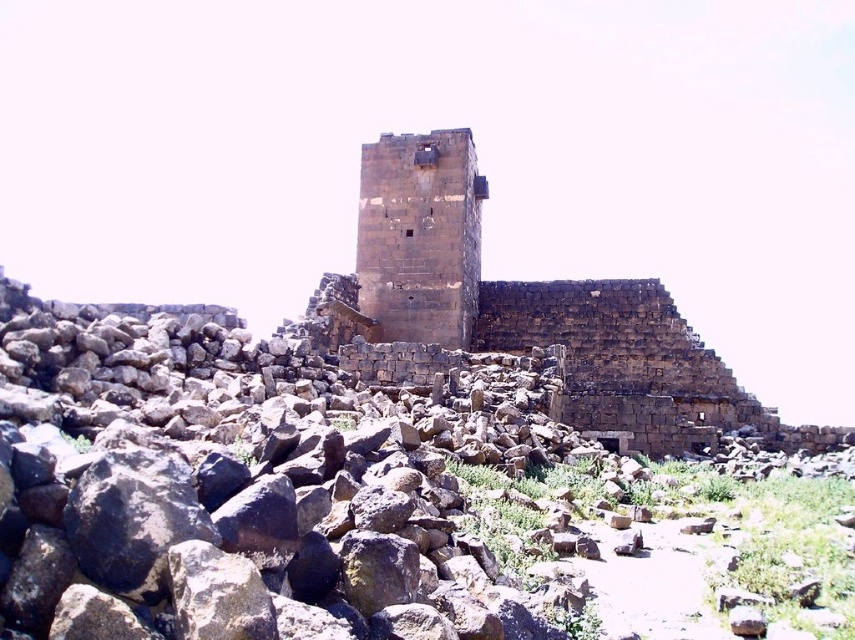
Question: Can you confirm if dark brown stone tower at center is positioned to the right of brown stone tower at center?

Choices:
 (A) yes
 (B) no

Answer: (A)

Question: Is dark brown stone tower at center above brown stone tower at center?

Choices:
 (A) yes
 (B) no

Answer: (B)

Question: Does dark brown stone tower at center appear on the right side of brown stone tower at center?

Choices:
 (A) yes
 (B) no

Answer: (A)

Question: Which of the following is the farthest from the observer?

Choices:
 (A) dark brown stone tower at center
 (B) brown stone tower at center

Answer: (B)

Question: Which of the following is the closest to the observer?

Choices:
 (A) brown stone tower at center
 (B) dark brown stone tower at center

Answer: (B)

Question: Which of the following is the closest to the observer?

Choices:
 (A) (394, 232)
 (B) (461, 218)

Answer: (B)